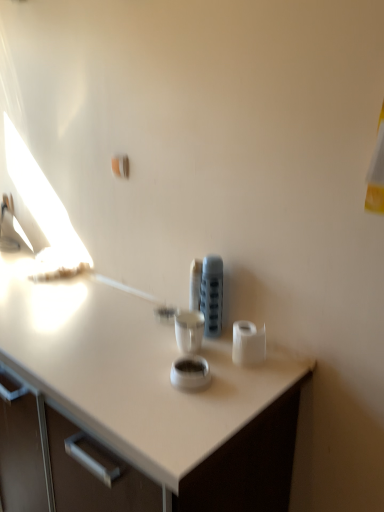
Image resolution: width=384 pixels, height=512 pixels. What do you see at coordinates (212, 295) in the screenshot? I see `matte plastic container at center` at bounding box center [212, 295].

Locate an element on the screen. The image size is (384, 512). matte plastic container at center is located at coordinates (212, 295).

Identify the location of white matte toilet paper at right. The height and width of the screenshot is (512, 384). (248, 343).

The height and width of the screenshot is (512, 384). Describe the element at coordinates (248, 343) in the screenshot. I see `white matte toilet paper at right` at that location.

Where is `matte plastic container at center`? matte plastic container at center is located at coordinates (212, 295).

Does matte plastic container at center appear on the left side of white matte toilet paper at right?

Correct, you'll find matte plastic container at center to the left of white matte toilet paper at right.

Which object is closer to the camera, matte plastic container at center or white matte toilet paper at right?

white matte toilet paper at right is in front.

Between point (210, 319) and point (247, 348), which one is positioned in front?

Point (247, 348)

From the image's perspective, which one is positioned lower, matte plastic container at center or white matte toilet paper at right?

white matte toilet paper at right appears lower in the image.

From a real-world perspective, who is located lower, matte plastic container at center or white matte toilet paper at right?

In real-world perspective, white matte toilet paper at right is lower.

Which object is wider, matte plastic container at center or white matte toilet paper at right?

white matte toilet paper at right is wider.

Does matte plastic container at center have a lesser height compared to white matte toilet paper at right?

No.

Looking at the image, does matte plastic container at center seem bigger or smaller compared to white matte toilet paper at right?

matte plastic container at center is bigger than white matte toilet paper at right.

Could white matte toilet paper at right be considered to be inside matte plastic container at center?

Definitely not — white matte toilet paper at right is not inside matte plastic container at center.

Is matte plastic container at center not close to white matte toilet paper at right?

matte plastic container at center is near white matte toilet paper at right, not far away.

Is matte plastic container at center turned away from white matte toilet paper at right?

No, white matte toilet paper at right is not at the back of matte plastic container at center.

How different are the orientations of matte plastic container at center and white matte toilet paper at right in degrees?

The angle between the facing direction of matte plastic container at center and the facing direction of white matte toilet paper at right is 0.195 degrees.

How distant is matte plastic container at center from white matte toilet paper at right?

matte plastic container at center is 6.15 inches away from white matte toilet paper at right.

I want to click on toilet paper located underneath the matte plastic container at center (from a real-world perspective), so click(248, 343).

Is white matte toilet paper at right to the right of matte plastic container at center from the viewer's perspective?

Yes.

Does white matte toilet paper at right lie behind matte plastic container at center?

No, white matte toilet paper at right is in front of matte plastic container at center.

Which is farther from the camera, (240,322) or (218,312)?

Positioned behind is point (218,312).

From the image's perspective, which object appears higher, white matte toilet paper at right or matte plastic container at center?

Result: matte plastic container at center, from the image's perspective.

From a real-world perspective, which is physically below, white matte toilet paper at right or matte plastic container at center?

white matte toilet paper at right is physically lower.

In terms of width, does white matte toilet paper at right look wider or thinner when compared to matte plastic container at center?

Clearly, white matte toilet paper at right has more width compared to matte plastic container at center.

Does white matte toilet paper at right have a greater height compared to matte plastic container at center?

No.

Considering the sizes of objects white matte toilet paper at right and matte plastic container at center in the image provided, who is bigger, white matte toilet paper at right or matte plastic container at center?

With larger size is matte plastic container at center.

Would you say white matte toilet paper at right is inside or outside matte plastic container at center?

white matte toilet paper at right is outside matte plastic container at center.

Is the surface of white matte toilet paper at right in direct contact with matte plastic container at center?

No, white matte toilet paper at right is not beside matte plastic container at center.

Does white matte toilet paper at right turn towards matte plastic container at center?

No.

How different are the orientations of white matte toilet paper at right and matte plastic container at center in degrees?

The angular difference between white matte toilet paper at right and matte plastic container at center is 0.195 degrees.

Find the location of `appliance that is on the left side of white matte toilet paper at right`. appliance that is on the left side of white matte toilet paper at right is located at coordinates (212, 295).

The width and height of the screenshot is (384, 512). Identify the location of appliance located on the left of white matte toilet paper at right. (212, 295).

Image resolution: width=384 pixels, height=512 pixels. Identify the location of toilet paper below the matte plastic container at center (from a real-world perspective). pyautogui.click(x=248, y=343).